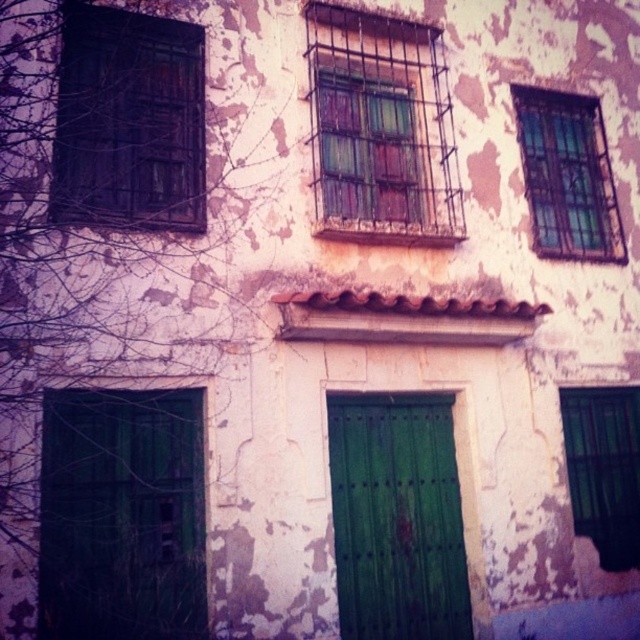
Which is below, dark wood window at upper left or clear glass window at upper right?

clear glass window at upper right

Is point (138, 163) less distant than point (588, 150)?

That is True.

Locate an element on the screen. Image resolution: width=640 pixels, height=640 pixels. dark wood window at upper left is located at coordinates pyautogui.click(x=129, y=122).

Is point (602, 161) closer to viewer compared to point (624, 547)?

That is False.

Is point (532, 237) positioned after point (605, 433)?

No, it is not.

What do you see at coordinates (566, 176) in the screenshot? The image size is (640, 640). I see `clear glass window at upper right` at bounding box center [566, 176].

The height and width of the screenshot is (640, 640). I want to click on clear glass window at upper right, so click(566, 176).

Between matte metal bars at center and clear glass window at upper right, which one appears on the left side from the viewer's perspective?

matte metal bars at center is more to the left.

Is matte metal bars at center smaller than clear glass window at upper right?

Actually, matte metal bars at center might be larger than clear glass window at upper right.

Is point (387, 134) closer to camera compared to point (556, 129)?

Yes.

You are a GUI agent. You are given a task and a screenshot of the screen. Output one action in this format:
    pyautogui.click(x=<x>, y=<y>)
    Task: Click on the matte metal bars at center
    The width and height of the screenshot is (640, 640).
    Given the screenshot: What is the action you would take?
    (380, 129)